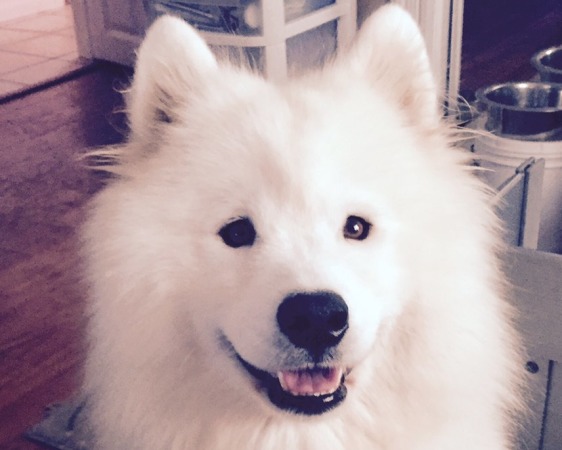
Image resolution: width=562 pixels, height=450 pixels. In order to click on chair in this screenshot , I will do `click(543, 295)`.